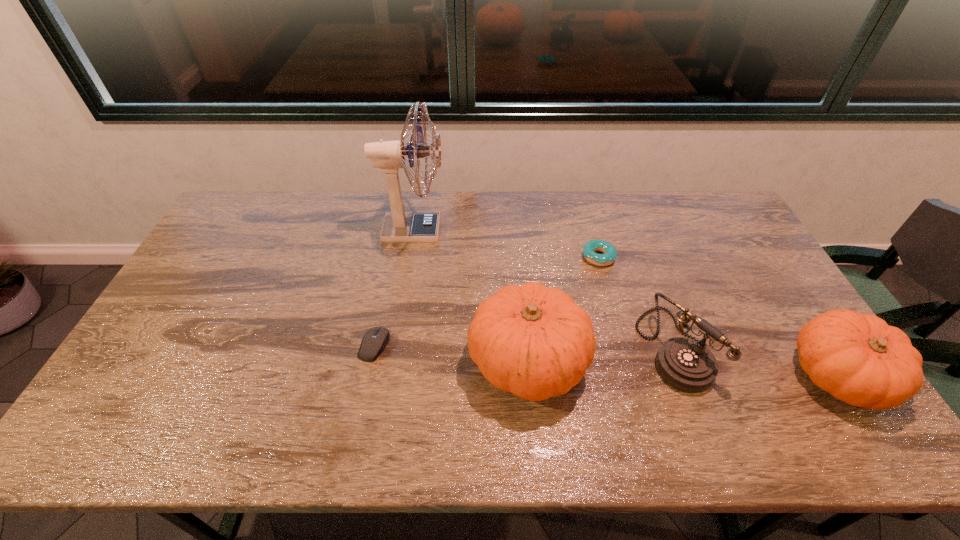
This screenshot has height=540, width=960. Identify the location of the third object from left to right. (535, 342).

Where is `the left pumpkin`? Image resolution: width=960 pixels, height=540 pixels. the left pumpkin is located at coordinates (535, 342).

Locate an element on the screen. the right pumpkin is located at coordinates (859, 359).

Find the location of a particular element. The width and height of the screenshot is (960, 540). the rightmost object is located at coordinates (859, 359).

Where is `doughnut`? Image resolution: width=960 pixels, height=540 pixels. doughnut is located at coordinates (609, 251).

You are a GUI agent. You are given a task and a screenshot of the screen. Output one action in this format:
    pyautogui.click(x=<x>, y=<y>)
    Task: Click on the fan
    The image size is (960, 540).
    Given the screenshot: What is the action you would take?
    pyautogui.click(x=399, y=227)

The image size is (960, 540). Find the location of `telephone`. telephone is located at coordinates 687,365.

Find the location of `computer equipment`. computer equipment is located at coordinates (375, 340).

The image size is (960, 540). Identify the location of free space located 0.140m on the back of the left pumpkin. (520, 280).

The image size is (960, 540). Find the location of `vacant region located on the back of the right pumpkin`. vacant region located on the back of the right pumpkin is located at coordinates (788, 299).